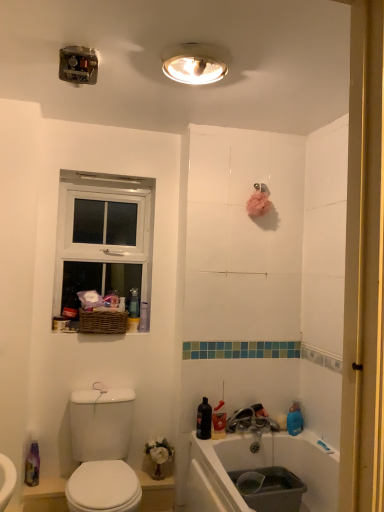
Question: Is white plastic light fixture at upper center directly adjacent to translucent plastic spray bottle at lower left?

Choices:
 (A) no
 (B) yes

Answer: (A)

Question: Is white plastic light fixture at upper center aimed at translucent plastic spray bottle at lower left?

Choices:
 (A) no
 (B) yes

Answer: (A)

Question: Can you confirm if white plastic light fixture at upper center is taller than translucent plastic spray bottle at lower left?

Choices:
 (A) yes
 (B) no

Answer: (B)

Question: Is white plastic light fixture at upper center closer to the viewer compared to translucent plastic spray bottle at lower left?

Choices:
 (A) yes
 (B) no

Answer: (A)

Question: From the image's perspective, is white plastic light fixture at upper center on top of translucent plastic spray bottle at lower left?

Choices:
 (A) no
 (B) yes

Answer: (B)

Question: Does white plastic light fixture at upper center have a lesser height compared to translucent plastic spray bottle at lower left?

Choices:
 (A) no
 (B) yes

Answer: (B)

Question: Is woven brown basket at upper left taller than translucent plastic spray bottle at lower left?

Choices:
 (A) no
 (B) yes

Answer: (A)

Question: Does woven brown basket at upper left turn towards translucent plastic spray bottle at lower left?

Choices:
 (A) yes
 (B) no

Answer: (B)

Question: Is woven brown basket at upper left turned away from translucent plastic spray bottle at lower left?

Choices:
 (A) no
 (B) yes

Answer: (A)

Question: Considering the relative sizes of woven brown basket at upper left and translucent plastic spray bottle at lower left in the image provided, is woven brown basket at upper left bigger than translucent plastic spray bottle at lower left?

Choices:
 (A) yes
 (B) no

Answer: (A)

Question: Is woven brown basket at upper left with translucent plastic spray bottle at lower left?

Choices:
 (A) yes
 (B) no

Answer: (B)

Question: From the image's perspective, is woven brown basket at upper left located beneath translucent plastic spray bottle at lower left?

Choices:
 (A) no
 (B) yes

Answer: (A)

Question: Could you tell me if white wooden window at upper left is turned towards woven brown basket at upper left?

Choices:
 (A) no
 (B) yes

Answer: (B)